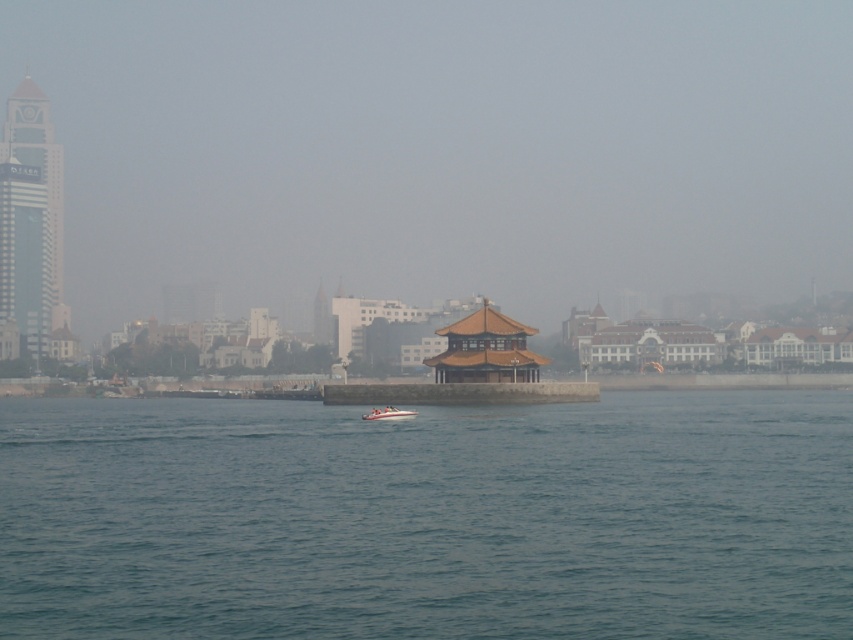
Question: Can you confirm if clear blue water at center is smaller than white glossy speedboat at center?

Choices:
 (A) no
 (B) yes

Answer: (A)

Question: Does gray glass skyscraper at left have a greater width compared to white glossy speedboat at center?

Choices:
 (A) no
 (B) yes

Answer: (B)

Question: Which of these objects is positioned closest to the clear blue water at center?

Choices:
 (A) white glossy speedboat at center
 (B) gray glass skyscraper at left

Answer: (A)

Question: Is gray glass skyscraper at left further to the viewer compared to white glossy speedboat at center?

Choices:
 (A) yes
 (B) no

Answer: (A)

Question: Which point is closer to the camera?

Choices:
 (A) (245, 451)
 (B) (387, 416)
 (C) (22, 250)

Answer: (A)

Question: Which of the following is the farthest from the observer?

Choices:
 (A) clear blue water at center
 (B) white glossy speedboat at center
 (C) gray glass skyscraper at left

Answer: (C)